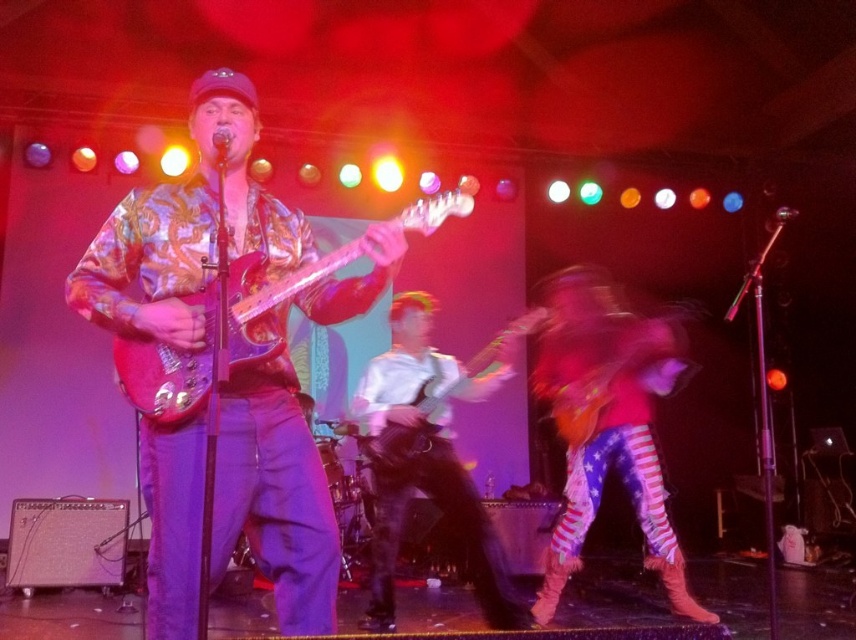
Is metallic floral shirt at center to the left of white glossy guitar at center from the viewer's perspective?

Correct, you'll find metallic floral shirt at center to the left of white glossy guitar at center.

Between point (311, 620) and point (403, 410), which one is positioned in front?

Point (311, 620) is more forward.

Find the location of a particular element. metallic floral shirt at center is located at coordinates (187, 227).

Does point (681, 593) lie behind point (414, 339)?

No, (681, 593) is in front of (414, 339).

Is american flag leggings at right shorter than glossy wood guitar at center?

No, american flag leggings at right is not shorter than glossy wood guitar at center.

Is point (651, 538) closer to camera compared to point (473, 369)?

No, it is not.

At what (x,y) coordinates should I click in order to perform the action: click on american flag leggings at right. Please return your answer as a coordinate pair (x, y). This screenshot has height=640, width=856. Looking at the image, I should click on (605, 424).

Does pink metallic guitar at center come in front of glossy wood guitar at center?

That is True.

Who is lower down, pink metallic guitar at center or glossy wood guitar at center?

glossy wood guitar at center

Measure the distance between pink metallic guitar at center and camera.

1.82 meters

I want to click on pink metallic guitar at center, so click(x=266, y=305).